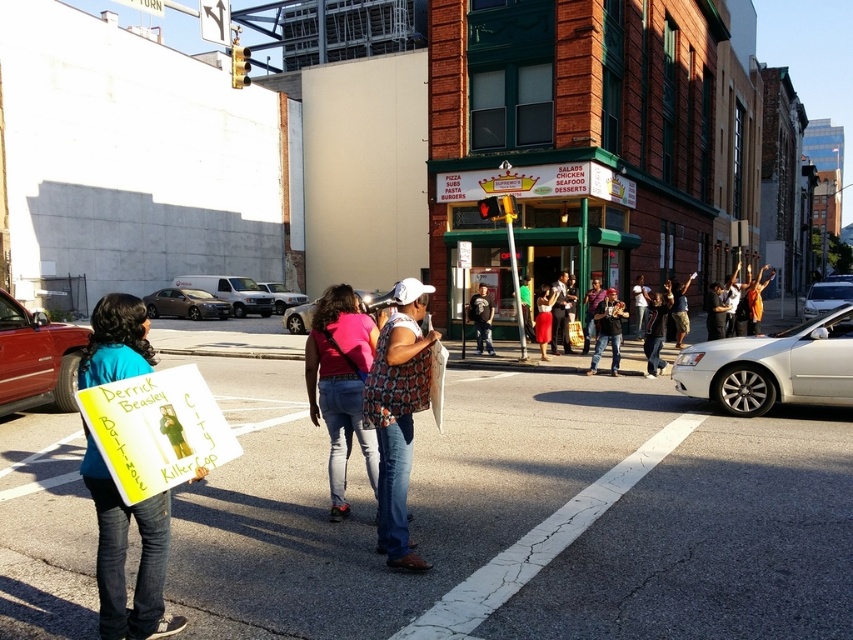
Does patterned fabric vest at center appear on the left side of silver metallic sedan at center?

Incorrect, patterned fabric vest at center is not on the left side of silver metallic sedan at center.

Who is more distant from viewer, (412,381) or (303,304)?

The point (303,304) is more distant.

Does point (390, 477) lie in front of point (300, 317)?

Yes, point (390, 477) is closer to viewer.

Where is `patterned fabric vest at center`? The height and width of the screenshot is (640, 853). patterned fabric vest at center is located at coordinates (398, 413).

Can you confirm if shiny red truck at left is shorter than silver metallic sedan at center-right?

Indeed, shiny red truck at left has a lesser height compared to silver metallic sedan at center-right.

Measure the distance between point [57,404] and camera.

10.38 meters

Who is more forward, (x=35, y=385) or (x=824, y=300)?

Positioned in front is point (x=35, y=385).

The image size is (853, 640). Find the location of `shiny red truck at left`. shiny red truck at left is located at coordinates (36, 358).

Which is more to the left, matte black sedan at center or dark blue jeans at center?

matte black sedan at center is more to the left.

From the picture: Is matte black sedan at center wider than dark blue jeans at center?

Yes.

Is point (155, 296) positioned before point (480, 321)?

No, (155, 296) is further to viewer.

Locate an element on the screen. The height and width of the screenshot is (640, 853). matte black sedan at center is located at coordinates (184, 304).